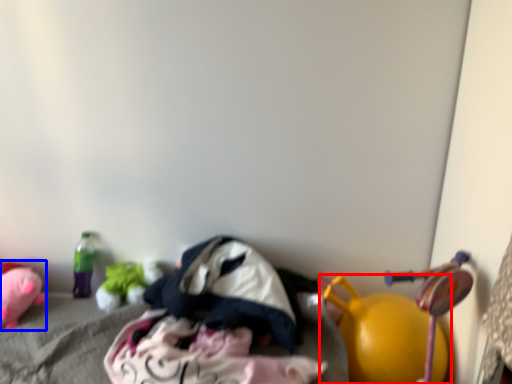
Question: Which object is closer to the camera taking this photo, toy (highlighted by a red box) or toy (highlighted by a blue box)?

Choices:
 (A) toy
 (B) toy

Answer: (A)